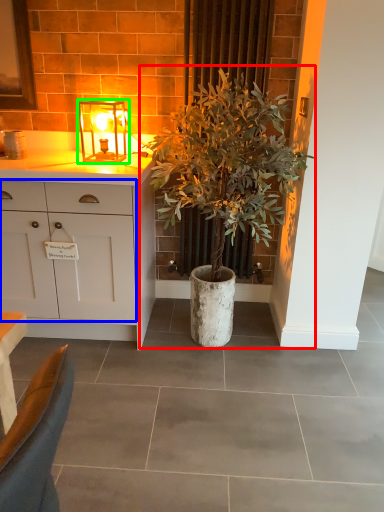
Question: Which is farther away from houseplant (highlighted by a red box)? cabinetry (highlighted by a blue box) or lamp (highlighted by a green box)?

Choices:
 (A) cabinetry
 (B) lamp

Answer: (B)